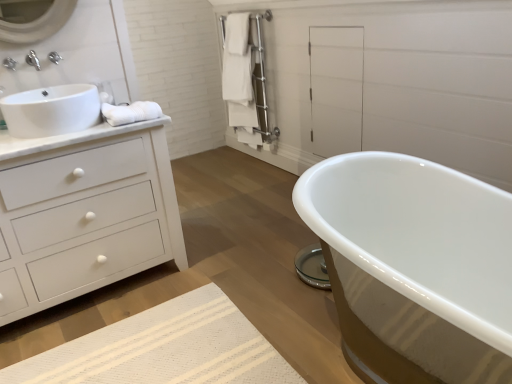
Find the location of a particular element. This screenshot has height=384, width=512. space that is in front of white matte chest of drawers at left is located at coordinates (109, 339).